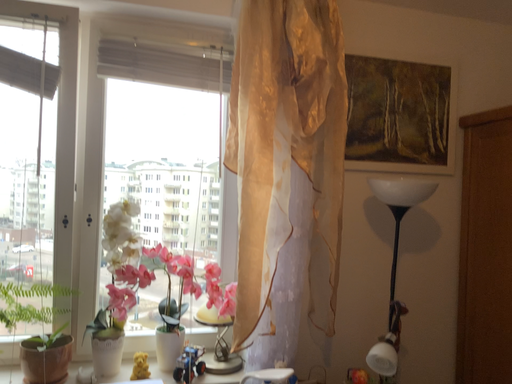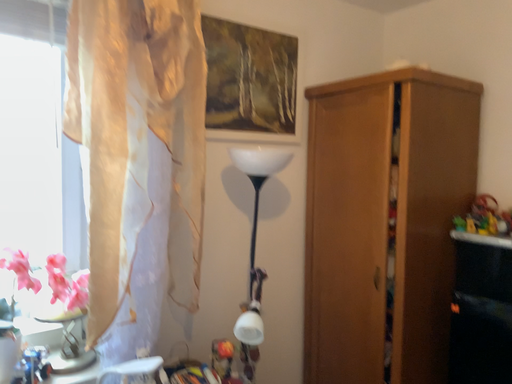
Question: Which way did the camera rotate in the video?

Choices:
 (A) rotated right
 (B) rotated left

Answer: (A)